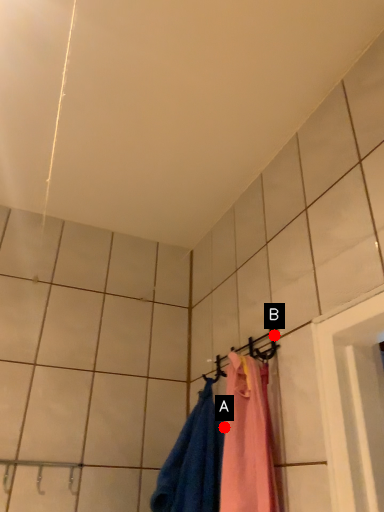
Question: Two points are circled on the image, labeled by A and B beside each circle. Which point is farther to the camera?

Choices:
 (A) A is further
 (B) B is further

Answer: (A)